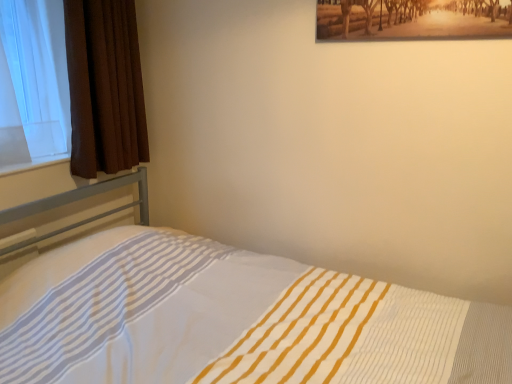
Where is `white striped bed at lower left`? The height and width of the screenshot is (384, 512). white striped bed at lower left is located at coordinates (232, 319).

Image resolution: width=512 pixels, height=384 pixels. What do you see at coordinates (232, 319) in the screenshot?
I see `white striped bed at lower left` at bounding box center [232, 319].

Measure the distance between white striped bed at lower left and camera.

The distance of white striped bed at lower left from camera is 4.19 feet.

What is the approximate height of brown textured curtain at left?

The height of brown textured curtain at left is 87.81 centimeters.

Image resolution: width=512 pixels, height=384 pixels. Describe the element at coordinates (104, 87) in the screenshot. I see `brown textured curtain at left` at that location.

Find the location of a particular element. brown textured curtain at left is located at coordinates (104, 87).

Image resolution: width=512 pixels, height=384 pixels. Find the location of `white striped bed at lower left`. white striped bed at lower left is located at coordinates (232, 319).

Can you confirm if brown textured curtain at left is positioned to the right of white striped bed at lower left?

In fact, brown textured curtain at left is to the left of white striped bed at lower left.

Which object is closer to the camera, brown textured curtain at left or white striped bed at lower left?

white striped bed at lower left is closer to the camera.

Is point (81, 95) behind point (393, 324)?

Yes, it is.

From the image's perspective, is brown textured curtain at left below white striped bed at lower left?

No, from the image's perspective, brown textured curtain at left is not beneath white striped bed at lower left.

Looking at this image, from a real-world perspective, which is physically above, brown textured curtain at left or white striped bed at lower left?

brown textured curtain at left, from a real-world perspective.

Considering the sizes of objects brown textured curtain at left and white striped bed at lower left in the image provided, who is thinner, brown textured curtain at left or white striped bed at lower left?

With smaller width is brown textured curtain at left.

Considering the sizes of objects brown textured curtain at left and white striped bed at lower left in the image provided, who is taller, brown textured curtain at left or white striped bed at lower left?

With more height is white striped bed at lower left.

Is brown textured curtain at left bigger or smaller than white striped bed at lower left?

Considering their sizes, brown textured curtain at left takes up less space than white striped bed at lower left.

Is brown textured curtain at left located outside white striped bed at lower left?

brown textured curtain at left lies outside white striped bed at lower left's area.

Is brown textured curtain at left positioned far away from white striped bed at lower left?

No, brown textured curtain at left is not far away from white striped bed at lower left.

Is brown textured curtain at left looking in the opposite direction of white striped bed at lower left?

brown textured curtain at left is not turned away from white striped bed at lower left.

From the picture: How different are the orientations of brown textured curtain at left and white striped bed at lower left in degrees?

The facing directions of brown textured curtain at left and white striped bed at lower left are 0.672 degrees apart.

Measure the distance between brown textured curtain at left and white striped bed at lower left.

brown textured curtain at left is 88.36 centimeters from white striped bed at lower left.

At what (x,y) coordinates should I click in order to perform the action: click on bed in front of the brown textured curtain at left. Please return your answer as a coordinate pair (x, y). Looking at the image, I should click on (232, 319).

Is white striped bed at lower left to the left of brown textured curtain at left from the viewer's perspective?

No, white striped bed at lower left is not to the left of brown textured curtain at left.

Which object is closer to the camera, white striped bed at lower left or brown textured curtain at left?

white striped bed at lower left.

Between point (65, 307) and point (90, 51), which one is positioned in front?

The point (65, 307) is closer to the camera.

From the image's perspective, is white striped bed at lower left located above or below brown textured curtain at left?

white striped bed at lower left is situated lower than brown textured curtain at left in the image.

From a real-world perspective, which is physically above, white striped bed at lower left or brown textured curtain at left?

brown textured curtain at left.

Can you confirm if white striped bed at lower left is wider than brown textured curtain at left?

Correct, the width of white striped bed at lower left exceeds that of brown textured curtain at left.

Can you confirm if white striped bed at lower left is shorter than brown textured curtain at left?

No, white striped bed at lower left is not shorter than brown textured curtain at left.

Who is smaller, white striped bed at lower left or brown textured curtain at left?

With smaller size is brown textured curtain at left.

Choose the correct answer: Is white striped bed at lower left inside brown textured curtain at left or outside it?

white striped bed at lower left lies outside brown textured curtain at left.

Is white striped bed at lower left not close to brown textured curtain at left?

They are positioned close to each other.

Is white striped bed at lower left facing away from brown textured curtain at left?

No, white striped bed at lower left is not facing the opposite direction of brown textured curtain at left.

Can you tell me how much white striped bed at lower left and brown textured curtain at left differ in facing direction?

0.672 degrees.

How distant is white striped bed at lower left from brown textured curtain at left?

white striped bed at lower left is 88.36 centimeters away from brown textured curtain at left.

Locate an element on the screen. bed on the right of brown textured curtain at left is located at coordinates (232, 319).

In the image, there is a white striped bed at lower left. Identify the location of curtain above it (from the image's perspective). The height and width of the screenshot is (384, 512). (104, 87).

Locate an element on the screen. The width and height of the screenshot is (512, 384). curtain located on the left of white striped bed at lower left is located at coordinates (104, 87).